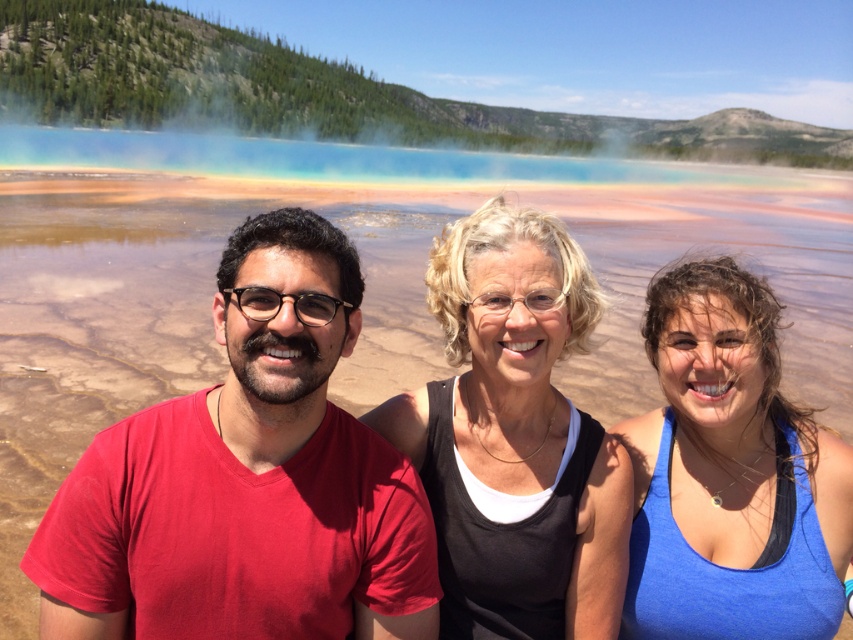
Can you confirm if matte red t-shirt at center is smaller than black matte tank top at center?

Correct, matte red t-shirt at center occupies less space than black matte tank top at center.

Is point (293, 605) positioned behind point (592, 435)?

No.

At what (x,y) coordinates should I click in order to perform the action: click on matte red t-shirt at center. Please return your answer as a coordinate pair (x, y). Looking at the image, I should click on (247, 480).

Can you confirm if red matte t-shirt at left is positioned to the left of black matte tank top at center?

Incorrect, red matte t-shirt at left is not on the left side of black matte tank top at center.

Between red matte t-shirt at left and black matte tank top at center, which one appears on the left side from the viewer's perspective?

black matte tank top at center

Which is in front, point (590, 221) or point (509, 483)?

Point (509, 483) is more forward.

Where is `red matte t-shirt at left`? Image resolution: width=853 pixels, height=640 pixels. red matte t-shirt at left is located at coordinates (160, 328).

Is matte red t-shirt at center further to camera compared to blue fabric tank top at center?

That is False.

Is matte red t-shirt at center wider than blue fabric tank top at center?

Result: Yes.

Where is `matte red t-shirt at center`? The image size is (853, 640). matte red t-shirt at center is located at coordinates (247, 480).

At what (x,y) coordinates should I click in order to perform the action: click on matte red t-shirt at center. Please return your answer as a coordinate pair (x, y). Looking at the image, I should click on (247, 480).